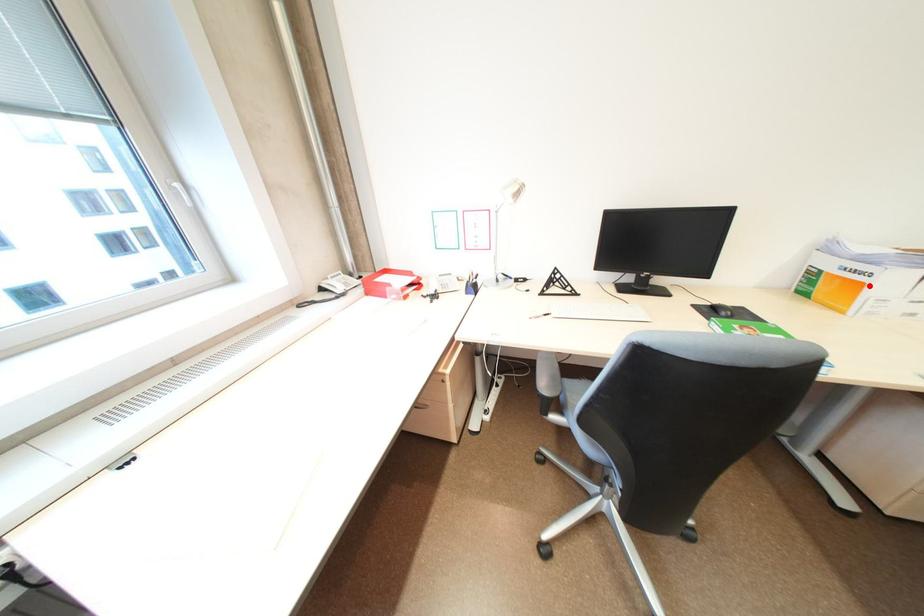
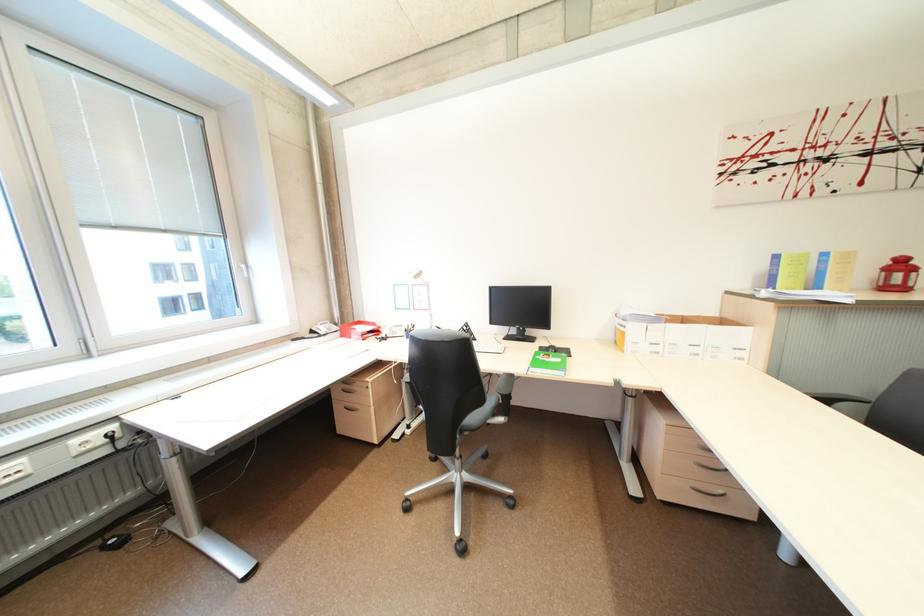
Question: I am providing you with two images of the same scene from different viewpoints. In image1, a red point is highlighted. Considering the same 3D point in image2, which of the following is correct?

Choices:
 (A) It is closer
 (B) It is farther

Answer: (A)